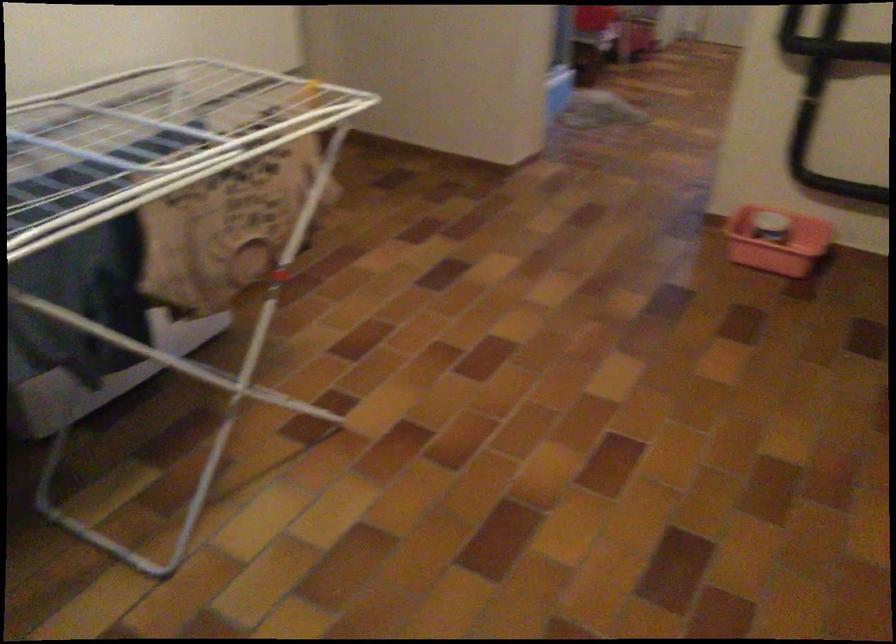
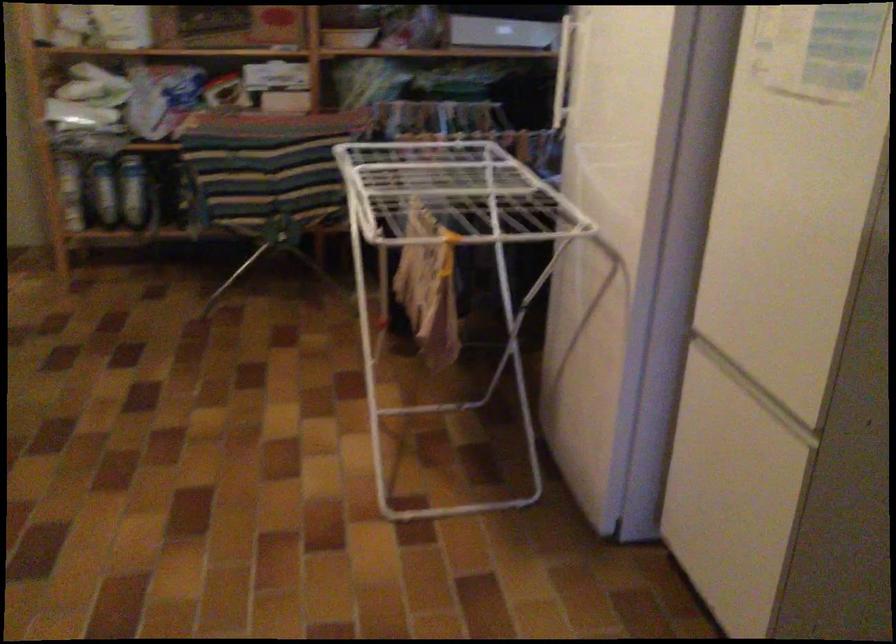
Where in the second image is the point corresponding to (289,118) from the first image?

(450, 258)